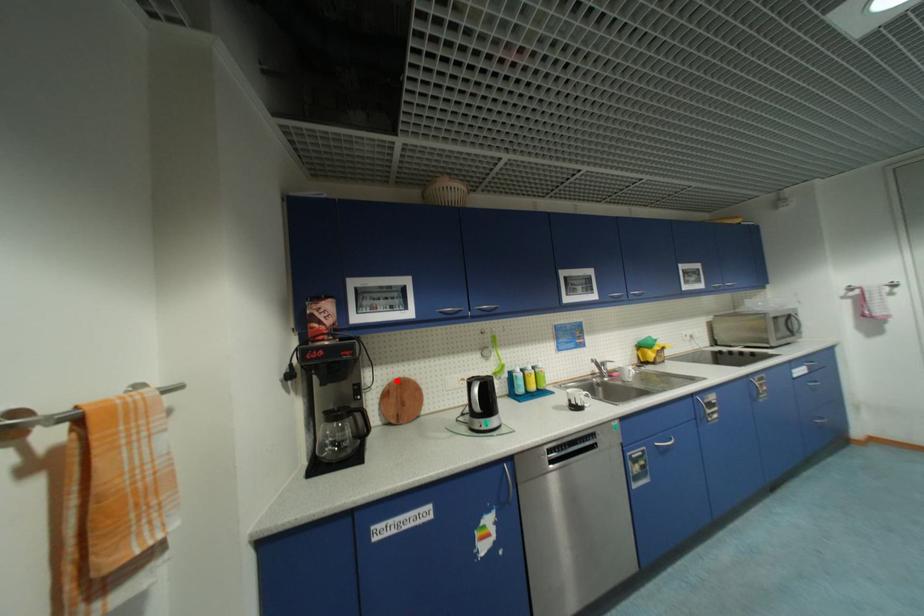
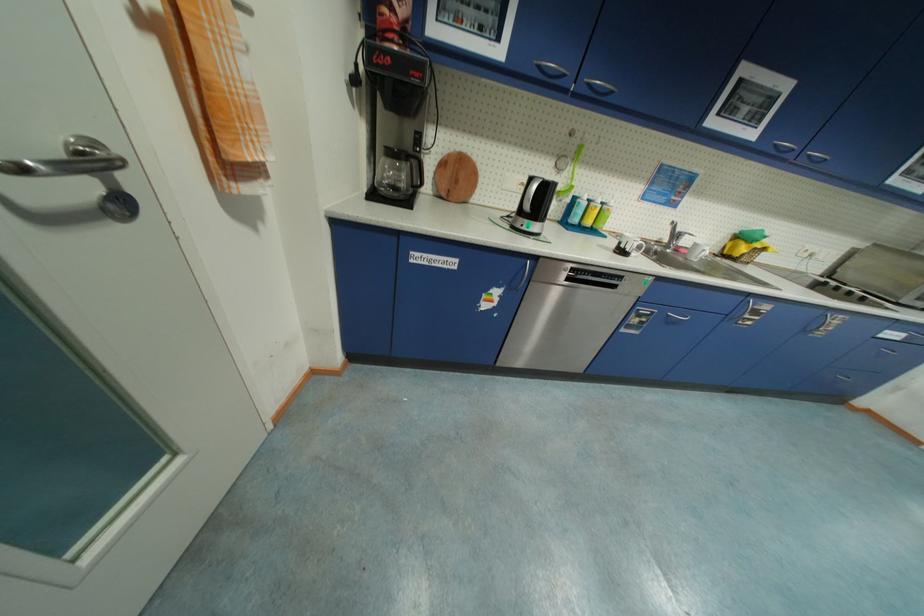
Question: I am providing you with two images of the same scene from different viewpoints. Image1 has a red point marked. In image2, the corresponding 3D location appears at what relative position? Reply with the corresponding letter.

Choices:
 (A) Closer
 (B) Farther

Answer: (A)